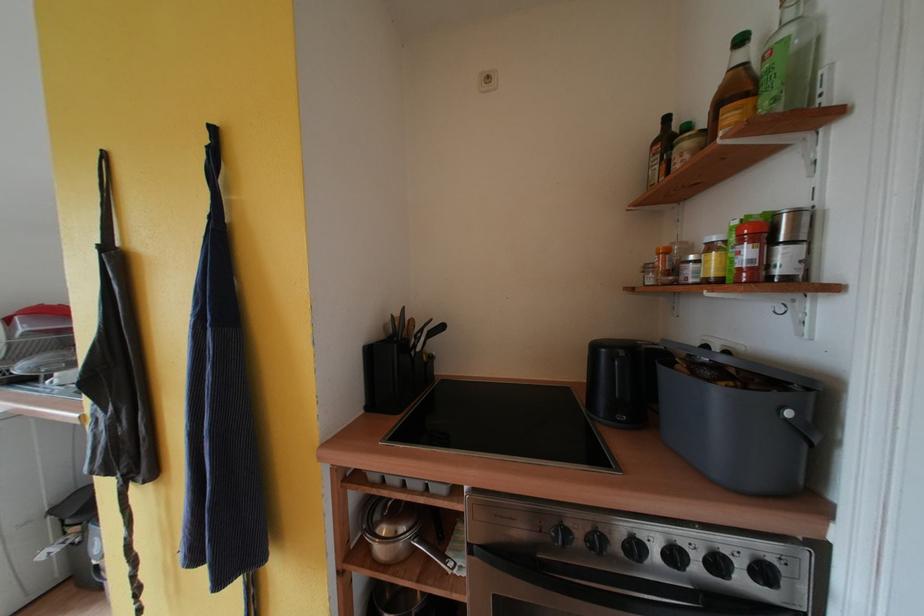
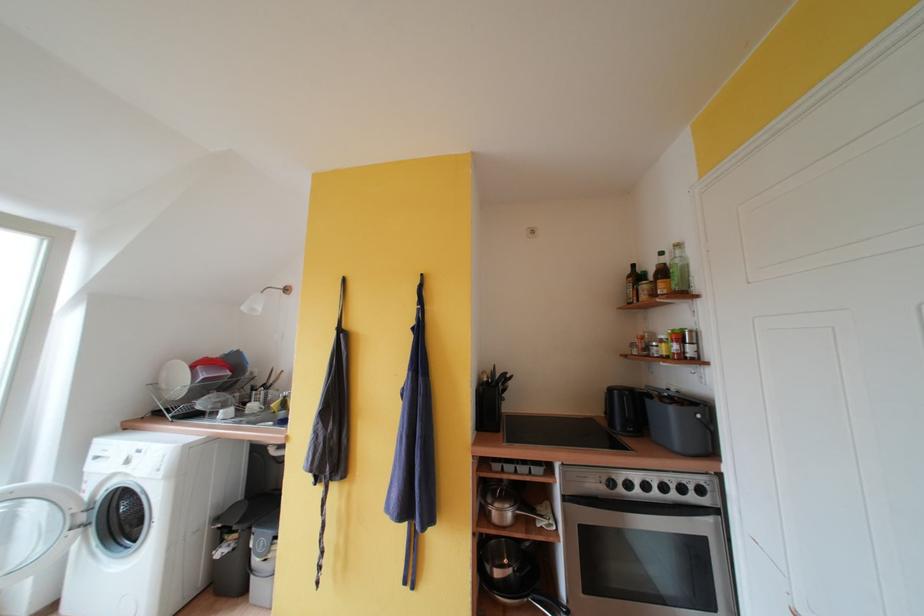
In the second image, find the point that corresponds to [383,521] in the first image.

(495, 504)